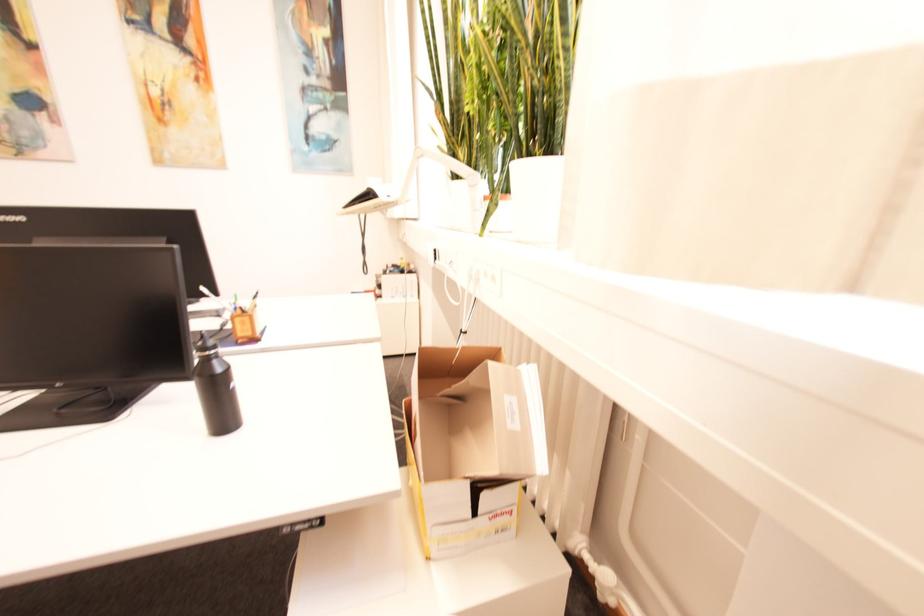
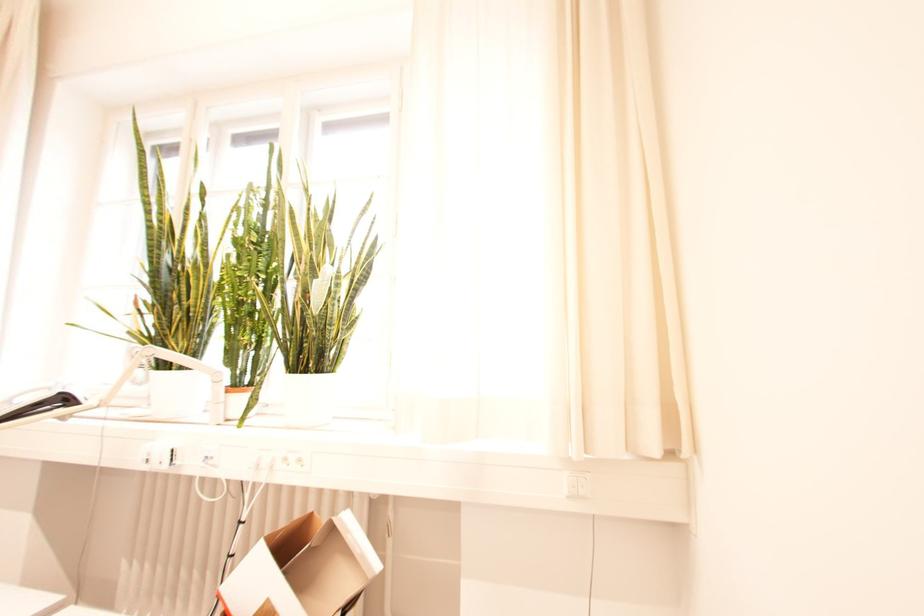
Question: Based on the continuous images, in which direction is the camera rotating? Reply with the corresponding letter.

Choices:
 (A) Left
 (B) Right
 (C) Up
 (D) Down

Answer: (B)